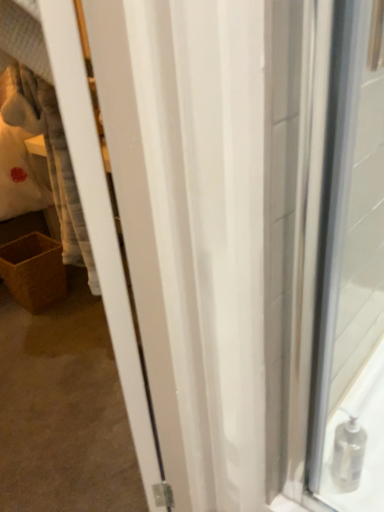
Question: Is clear plastic soap dispenser at lower right positioned far away from brown woven basket at lower left?

Choices:
 (A) no
 (B) yes

Answer: (B)

Question: Can you confirm if clear plastic soap dispenser at lower right is bigger than brown woven basket at lower left?

Choices:
 (A) no
 (B) yes

Answer: (A)

Question: Does clear plastic soap dispenser at lower right come behind brown woven basket at lower left?

Choices:
 (A) no
 (B) yes

Answer: (A)

Question: From the image's perspective, would you say clear plastic soap dispenser at lower right is shown under brown woven basket at lower left?

Choices:
 (A) yes
 (B) no

Answer: (A)

Question: Can you confirm if clear plastic soap dispenser at lower right is smaller than brown woven basket at lower left?

Choices:
 (A) yes
 (B) no

Answer: (A)

Question: Considering the relative sizes of clear plastic soap dispenser at lower right and brown woven basket at lower left in the image provided, is clear plastic soap dispenser at lower right shorter than brown woven basket at lower left?

Choices:
 (A) yes
 (B) no

Answer: (A)

Question: Is brown woven basket at lower left smaller than clear plastic soap dispenser at lower right?

Choices:
 (A) no
 (B) yes

Answer: (A)

Question: From a real-world perspective, is brown woven basket at lower left located higher than clear plastic soap dispenser at lower right?

Choices:
 (A) no
 (B) yes

Answer: (A)

Question: Is brown woven basket at lower left bigger than clear plastic soap dispenser at lower right?

Choices:
 (A) yes
 (B) no

Answer: (A)

Question: Can you confirm if brown woven basket at lower left is taller than clear plastic soap dispenser at lower right?

Choices:
 (A) yes
 (B) no

Answer: (A)

Question: Is clear plastic soap dispenser at lower right located within brown woven basket at lower left?

Choices:
 (A) no
 (B) yes

Answer: (A)

Question: Is brown woven basket at lower left in contact with clear plastic soap dispenser at lower right?

Choices:
 (A) yes
 (B) no

Answer: (B)

Question: Is point (365, 505) closer or farther from the camera than point (51, 303)?

Choices:
 (A) closer
 (B) farther

Answer: (A)